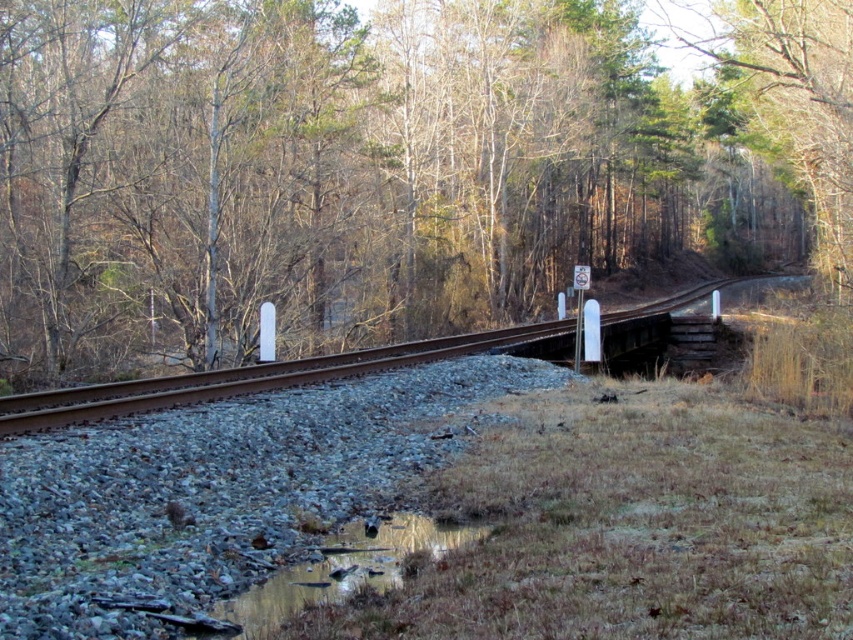
You are standing at the bottom left corner of the scene where the puddle is. You want to walk towards the tunnel entrance. Which object will you pass first, the brown wood tree at center or the reflective wet grass at lower center?

You will pass the reflective wet grass at lower center first because the brown wood tree at center is to the right of it, meaning the grass is closer to your starting position near the puddle.

You are a train engineer approaching the brown metal train track at center. There is a brown wood tree at center blocking your path. Can you safely pass through without hitting the tree?

The brown wood tree at center is further to the viewer than the brown metal train track at center, meaning the tree is closer to you. Therefore, you cannot safely pass through without hitting the tree.